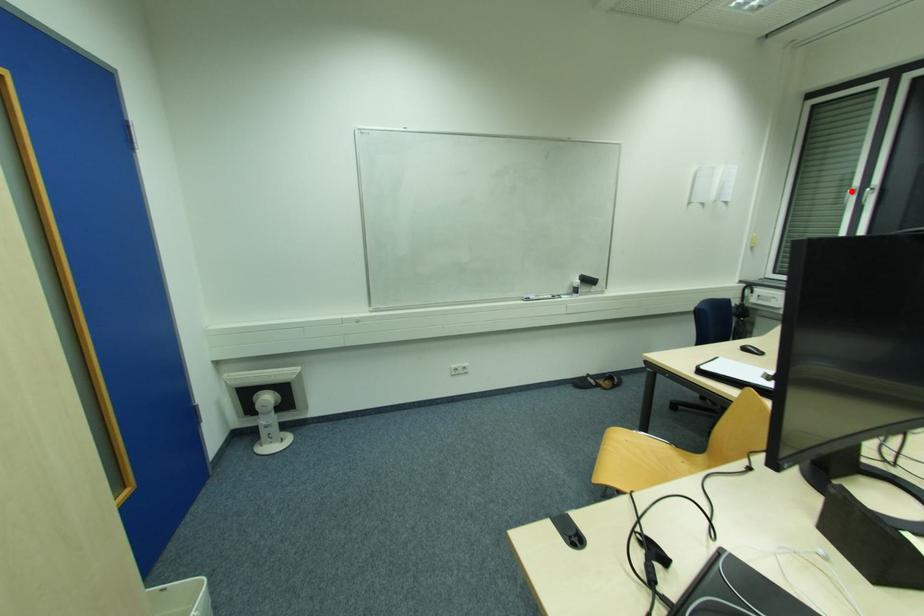
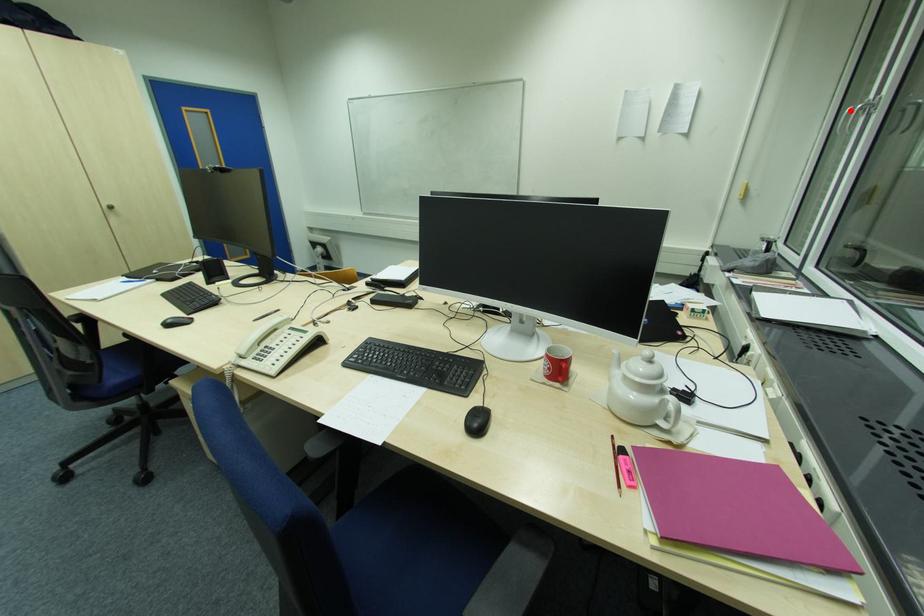
I am providing you with two images of the same scene from different viewpoints. A red point is marked on the first image and another point is marked on the second image. Do the highlighted points in image1 and image2 indicate the same real-world spot?

Yes